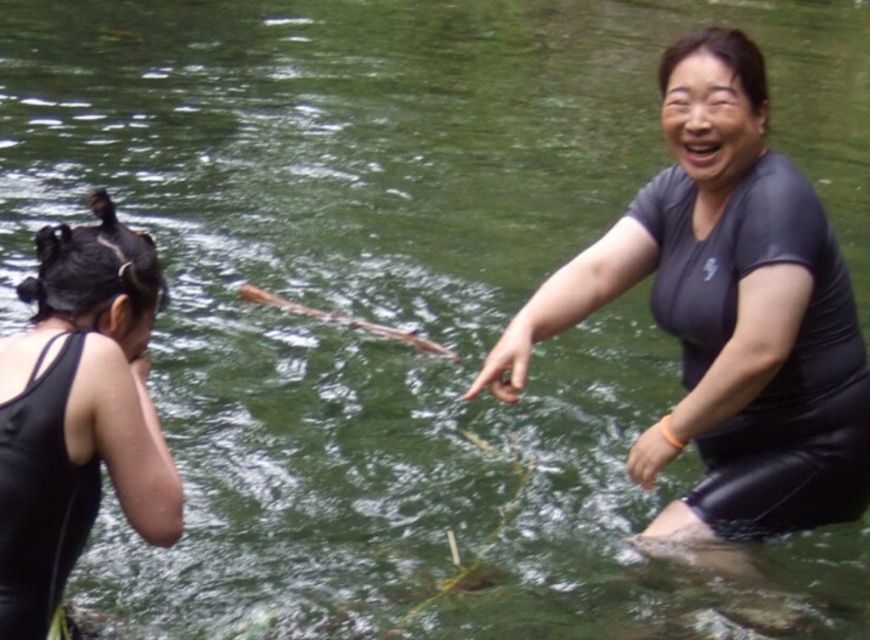
Question: Which object appears farthest from the camera in this image?

Choices:
 (A) black matte swimsuit at center
 (B) black matte wetsuit at left

Answer: (A)

Question: Does black matte wetsuit at right appear under black matte wetsuit at left?

Choices:
 (A) yes
 (B) no

Answer: (B)

Question: Does black matte swimsuit at center come in front of black matte swimsuit at left?

Choices:
 (A) yes
 (B) no

Answer: (B)

Question: Which object appears closest to the camera in this image?

Choices:
 (A) black matte swimsuit at left
 (B) black matte wetsuit at right

Answer: (A)

Question: Which point is closer to the camera?

Choices:
 (A) black matte wetsuit at left
 (B) black matte swimsuit at center
 (C) black matte wetsuit at right
 (D) black matte swimsuit at left

Answer: (A)

Question: Can you confirm if black matte swimsuit at center is bigger than black matte swimsuit at left?

Choices:
 (A) no
 (B) yes

Answer: (B)